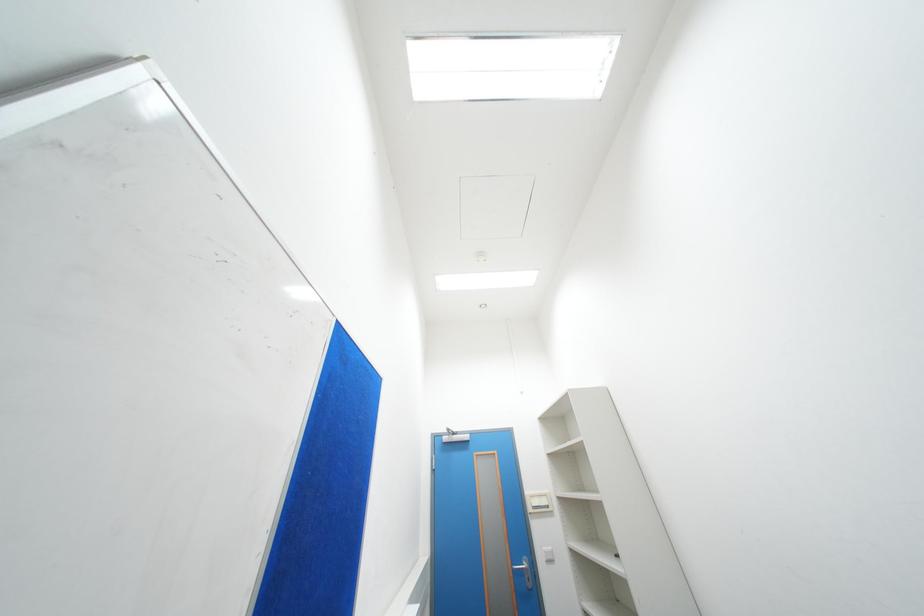
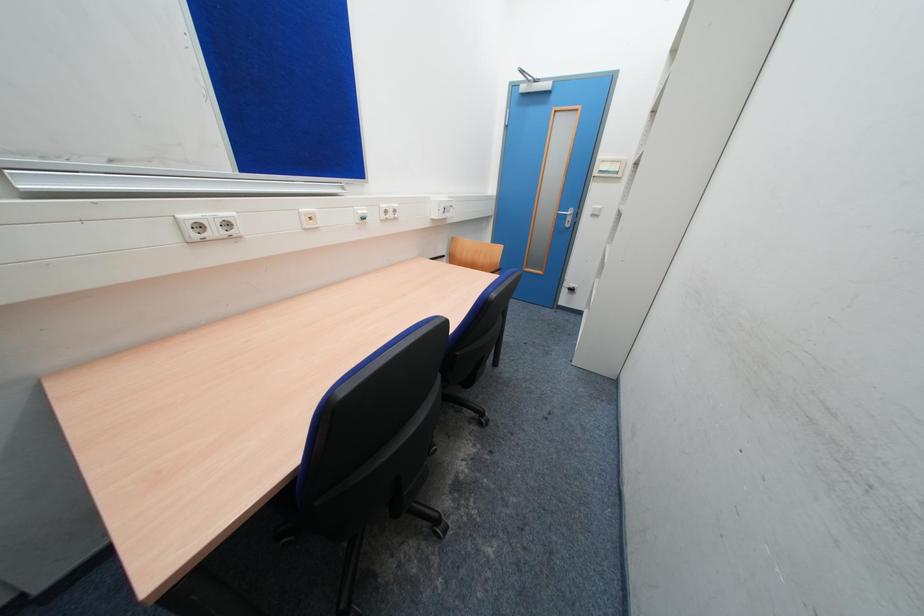
How did the camera likely rotate?

The camera's rotation is toward left-down.